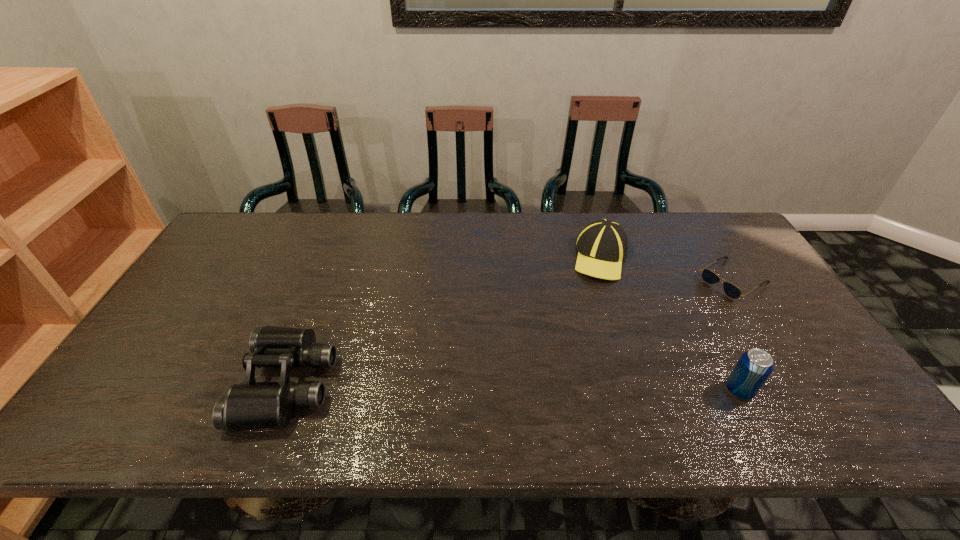
Identify the location of free spot on the desktop that is between the leftmost object and the third object from left to right and is positioned on the front-facing side of the rightmost object. This screenshot has height=540, width=960. (566, 388).

Where is `vacant spot on the desktop that is between the leftmost object and the third object from left to right and is positioned with the brim of the second object from left to right facing forward`? vacant spot on the desktop that is between the leftmost object and the third object from left to right and is positioned with the brim of the second object from left to right facing forward is located at coordinates tap(527, 387).